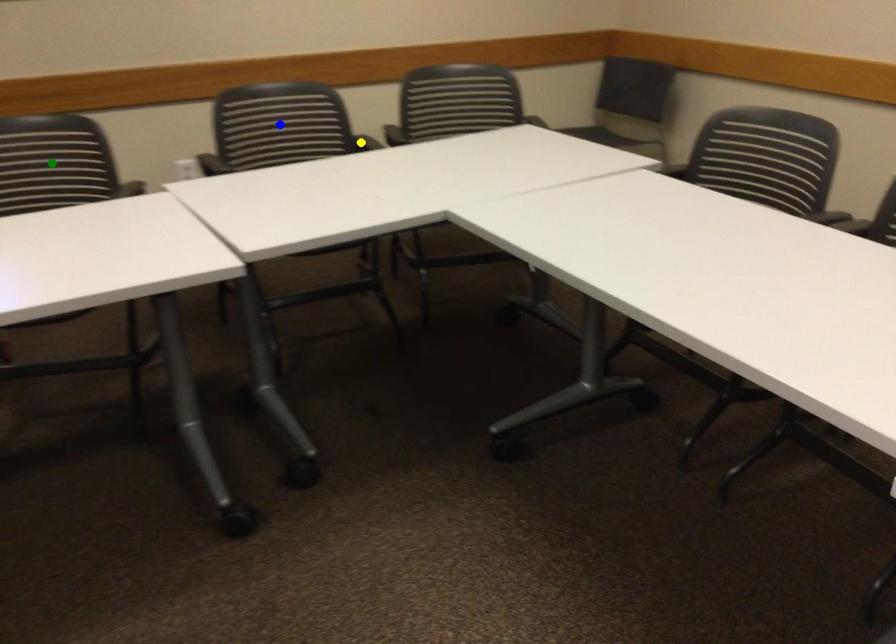
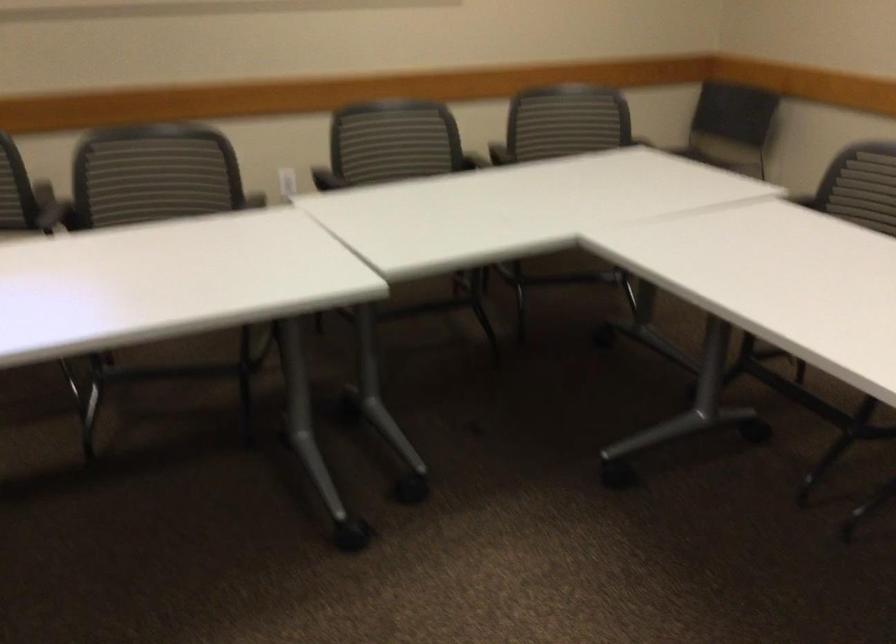
I am providing you with two images of the same scene from different viewpoints. Three points are marked in image1. Which point corresponds to a part or object that is occluded in image2?In image1, three points are marked. Which of them correspond to a part or object that is occluded in image2?Among the three points shown in image1, which one corresponds to a part or object that is no longer visible due to occlusion in image2?

yellow point, blue point, green point